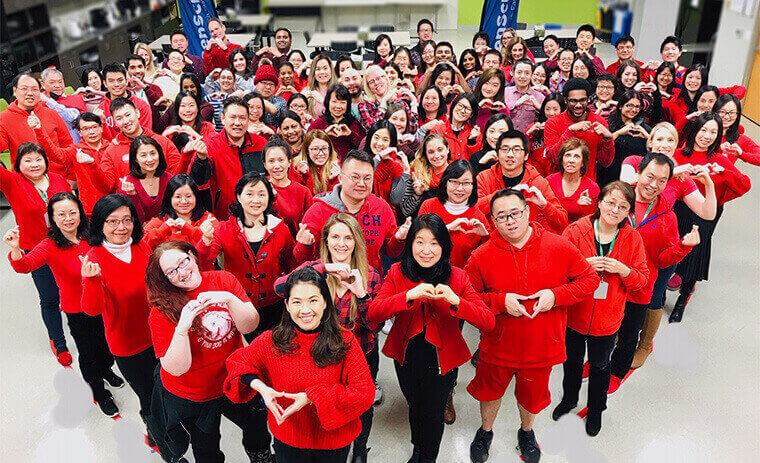
Identify the location of space between tables in background. The height and width of the screenshot is (463, 760). (453, 35).